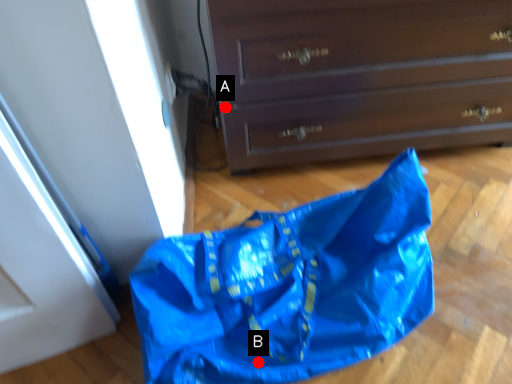
Question: Two points are circled on the image, labeled by A and B beside each circle. Among these points, which one is farthest from the camera?

Choices:
 (A) A is further
 (B) B is further

Answer: (A)